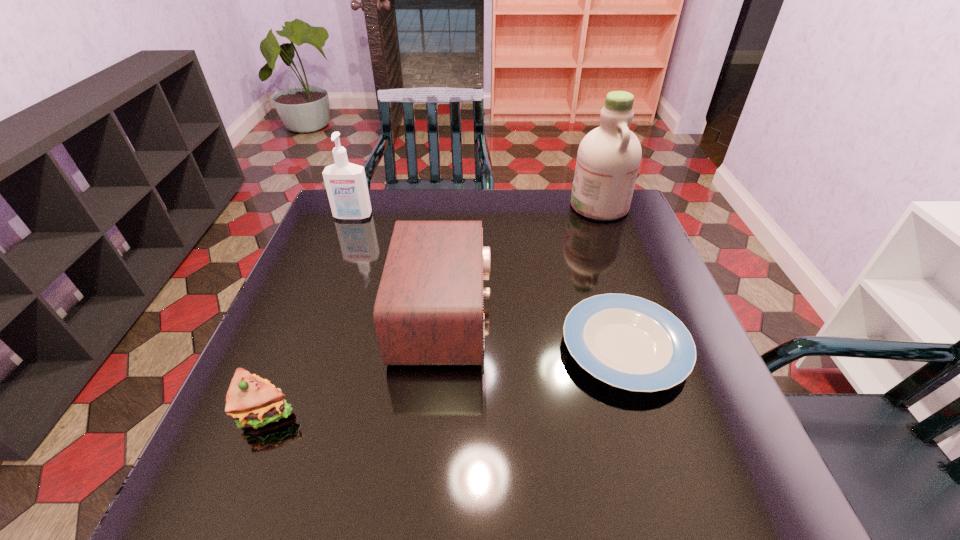
At what (x,y) coordinates should I click in order to perform the action: click on object at the far right corner. Please return your answer as a coordinate pair (x, y). This screenshot has width=960, height=540. Looking at the image, I should click on (608, 159).

Identify the location of vacant space at the far edge of the desktop. (504, 194).

Where is `blank space at the near edge`? This screenshot has height=540, width=960. blank space at the near edge is located at coordinates (348, 507).

The image size is (960, 540). In order to click on vacant space at the left edge of the desktop in this screenshot , I will do `click(297, 419)`.

The width and height of the screenshot is (960, 540). In order to click on blank space at the right edge of the desktop in this screenshot , I will do `click(717, 450)`.

Locate an element on the screen. The height and width of the screenshot is (540, 960). free region at the far left corner of the desktop is located at coordinates (334, 221).

Locate an element on the screen. Image resolution: width=960 pixels, height=540 pixels. free space at the near right corner of the desktop is located at coordinates (671, 478).

The width and height of the screenshot is (960, 540). Identify the location of empty location between the sandwich and the plate. (445, 379).

What are the coordinates of `free spot between the sandwich and the shorter cleansing agent` in the screenshot? It's located at (309, 314).

Where is `empty location between the shortest object and the left cleansing agent`? Image resolution: width=960 pixels, height=540 pixels. empty location between the shortest object and the left cleansing agent is located at coordinates (489, 282).